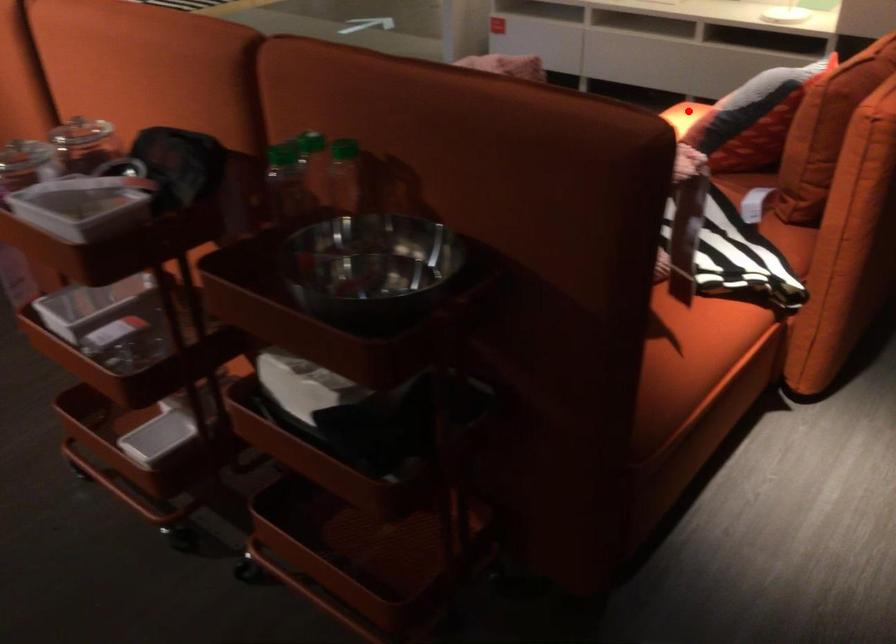
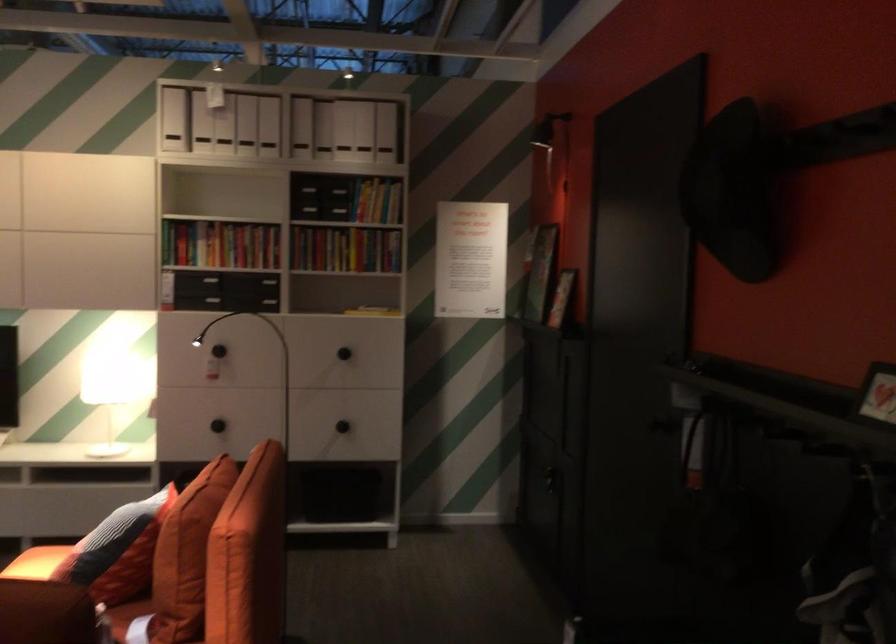
Find the pixel in the second image that matches the highlighted location in the first image.

(36, 563)